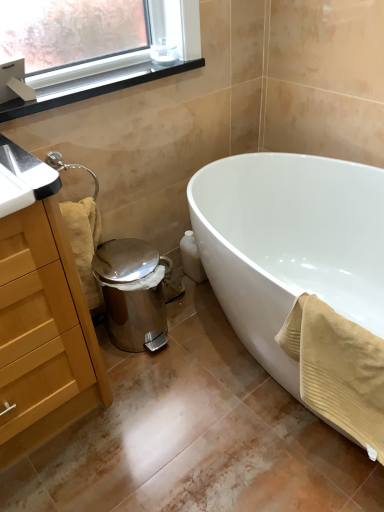
The image size is (384, 512). Identify the location of free spot above black plastic window sill at upper left (from a real-world perspective). (100, 79).